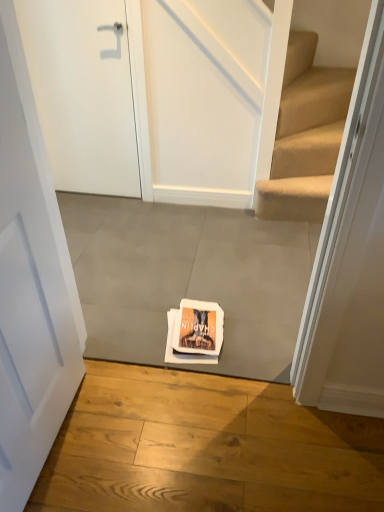
Identify the location of blank space above gray concrete at center, the 2th concrete in the bottom-to-top sequence (from a real-world perspective). (173, 259).